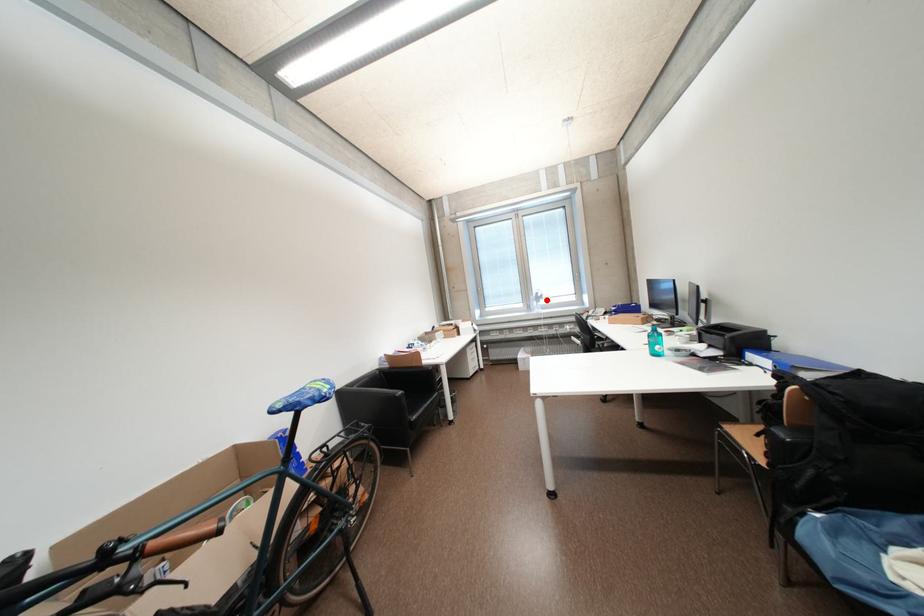
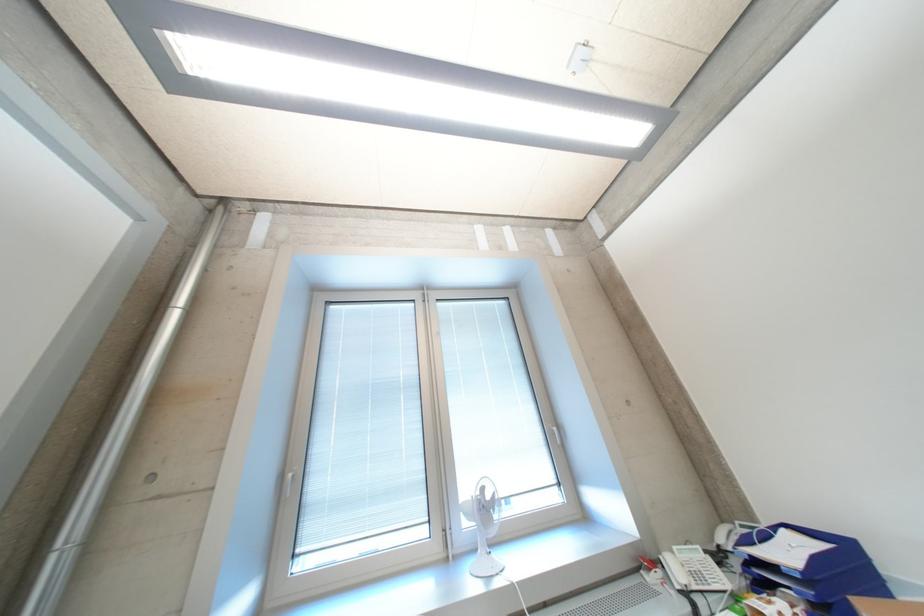
The point at the highlighted location is marked in the first image. Where is the corresponding point in the second image?

(492, 509)